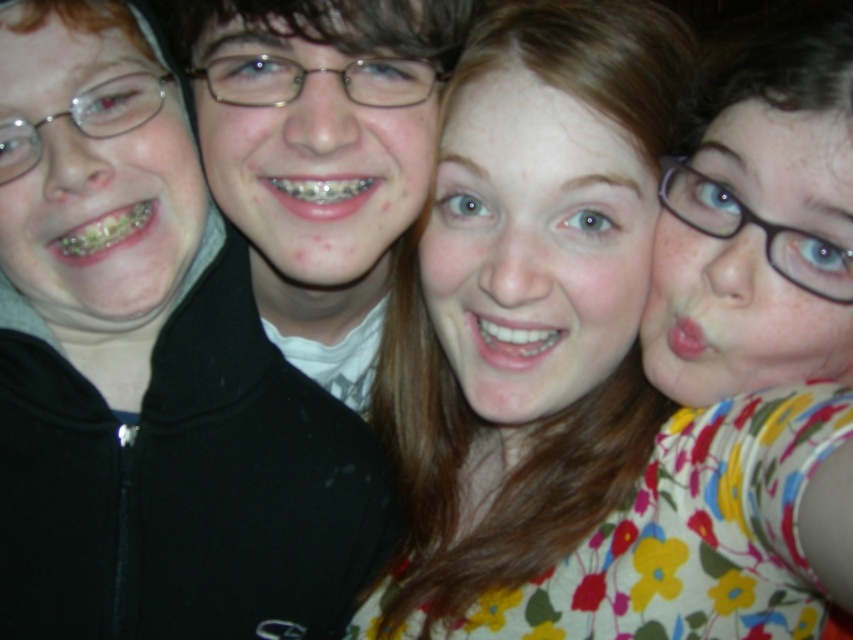
Who is more distant from viewer, (320, 577) or (421, 67)?

The point (320, 577) is more distant.

Is matte floral shirt at center to the right of matte black jacket at center from the viewer's perspective?

In fact, matte floral shirt at center is to the left of matte black jacket at center.

Is point (206, 369) less distant than point (259, 90)?

No, (206, 369) is behind (259, 90).

Locate an element on the screen. matte floral shirt at center is located at coordinates (186, 486).

Is floral fabric dress at center smaller than matte floral shirt at center?

Incorrect, floral fabric dress at center is not smaller in size than matte floral shirt at center.

Is floral fabric dress at center below matte floral shirt at center?

Actually, floral fabric dress at center is above matte floral shirt at center.

At what (x,y) coordinates should I click in order to perform the action: click on floral fabric dress at center. Please return your answer as a coordinate pair (x, y). Looking at the image, I should click on (579, 454).

Where is `floral fabric dress at center`? floral fabric dress at center is located at coordinates (579, 454).

Does floral fabric dress at center come behind matte black jacket at center?

No, floral fabric dress at center is closer to the viewer.

Which of these two, floral fabric dress at center or matte black jacket at center, stands shorter?

matte black jacket at center

You are a GUI agent. You are given a task and a screenshot of the screen. Output one action in this format:
    pyautogui.click(x=<x>, y=<y>)
    Task: Click on the floral fabric dress at center
    
    Given the screenshot: What is the action you would take?
    pyautogui.click(x=579, y=454)